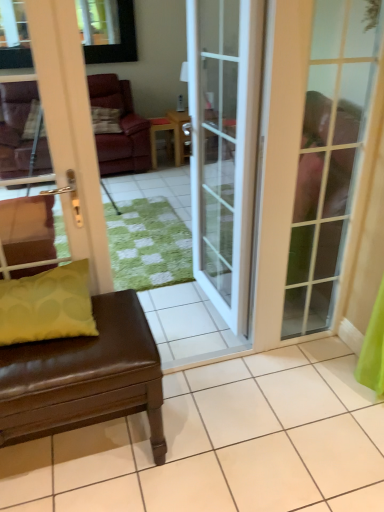
The image size is (384, 512). In order to click on matte glass door at right, positioned as the first door in right-to-left order in this screenshot , I will do `click(314, 161)`.

Measure the distance between point (56, 322) and camera.

Point (56, 322) and camera are 4.60 feet apart.

Locate an element on the screen. Image resolution: width=384 pixels, height=512 pixels. white glossy door at left, the third door viewed from the right is located at coordinates (70, 131).

Identify the location of wooden side table at center. This screenshot has height=512, width=384. (167, 131).

Where is `brown leather studio couch at left`? brown leather studio couch at left is located at coordinates (84, 376).

From a real-world perspective, which object stands above the other?

white glass door at center, the second door viewed from the left, is physically above.

Consider the image. Which object is closer to the camera taking this photo, matte glass door at right, which appears as the third door when viewed from the left, or white glass door at center, the 2th door when ordered from right to left?

matte glass door at right, which appears as the third door when viewed from the left, is closer to the camera.

Is matte glass door at right, which appears as the third door when viewed from the left, not inside white glass door at center, the 2th door when ordered from right to left?

Yes, matte glass door at right, which appears as the third door when viewed from the left, is located beyond the bounds of white glass door at center, the 2th door when ordered from right to left.

Who is shorter, matte glass door at right, positioned as the first door in right-to-left order, or white glass door at center, the 2th door when ordered from right to left?

matte glass door at right, positioned as the first door in right-to-left order.

Which is closer to the camera, (x=238, y=106) or (x=67, y=401)?

The point (x=67, y=401) is closer.

Between white glass door at center, the second door viewed from the left, and brown leather studio couch at left, which one has smaller width?

white glass door at center, the second door viewed from the left.

From their relative heights in the image, would you say white glass door at center, the second door viewed from the left, is taller or shorter than brown leather studio couch at left?

Considering their sizes, white glass door at center, the second door viewed from the left, has more height than brown leather studio couch at left.

Based on the photo, from the image's perspective, is white glass door at center, the second door viewed from the left, above or below brown leather studio couch at left?

From the image's perspective, white glass door at center, the second door viewed from the left, appears above brown leather studio couch at left.

Considering the sizes of objects white glass door at center, the 2th door when ordered from right to left, and wooden side table at center in the image provided, who is bigger, white glass door at center, the 2th door when ordered from right to left, or wooden side table at center?

With larger size is wooden side table at center.

Is white glass door at center, the 2th door when ordered from right to left, wider than wooden side table at center?

In fact, white glass door at center, the 2th door when ordered from right to left, might be narrower than wooden side table at center.

Find the location of a particular element. The image size is (384, 512). the 1st door to the right when counting from the wooden side table at center is located at coordinates (224, 146).

Is white glass door at center, the 2th door when ordered from right to left, to the right of wooden side table at center from the viewer's perspective?

Indeed, white glass door at center, the 2th door when ordered from right to left, is positioned on the right side of wooden side table at center.

Is matte glass door at right, positioned as the first door in right-to-left order, in front of wooden side table at center?

Yes, it is.

How different are the orientations of matte glass door at right, positioned as the first door in right-to-left order, and wooden side table at center in degrees?

The angular difference between matte glass door at right, positioned as the first door in right-to-left order, and wooden side table at center is 3.07 degrees.

Identify the location of the 2nd door in front when counting from the wooden side table at center. (314, 161).

Between point (237, 38) and point (174, 143), which one is positioned in front?

The point (237, 38) is in front.

Is brown leather studio couch at left at the left side of white glass door at center, the second door viewed from the left?

Correct, you'll find brown leather studio couch at left to the left of white glass door at center, the second door viewed from the left.

Locate an element on the screen. Image resolution: width=384 pixels, height=512 pixels. studio couch that appears below the white glass door at center, the second door viewed from the left (from the image's perspective) is located at coordinates (84, 376).

Which object is closer to the camera taking this photo, brown leather studio couch at left or white glass door at center, the 2th door when ordered from right to left?

brown leather studio couch at left is closer to the camera.

From a real-world perspective, between brown leather studio couch at left and white glass door at center, the second door viewed from the left, who is vertically higher?

In real-world perspective, white glass door at center, the second door viewed from the left, is above.

Based on the photo, is brown leather studio couch at left to the left of wooden side table at center from the viewer's perspective?

Yes.

From a real-world perspective, which object stands above the other?

brown leather studio couch at left.

From the image's perspective, is brown leather studio couch at left located beneath wooden side table at center?

Yes, from the image's perspective, brown leather studio couch at left is beneath wooden side table at center.

Is wooden side table at center to the left or to the right of white glass door at center, the 2th door when ordered from right to left, in the image?

wooden side table at center is positioned on white glass door at center, the 2th door when ordered from right to left,'s left side.

From a real-world perspective, between wooden side table at center and white glass door at center, the 2th door when ordered from right to left, who is vertically higher?

white glass door at center, the 2th door when ordered from right to left.

Considering the positions of objects wooden side table at center and white glass door at center, the second door viewed from the left, in the image provided, who is in front, wooden side table at center or white glass door at center, the second door viewed from the left,?

white glass door at center, the second door viewed from the left, is more forward.

Can you confirm if wooden side table at center is thinner than white glass door at center, the 2th door when ordered from right to left?

No, wooden side table at center is not thinner than white glass door at center, the 2th door when ordered from right to left.

Where is `door that is the 2nd object located above the matte glass door at right, positioned as the first door in right-to-left order (from the image's perspective)`? Image resolution: width=384 pixels, height=512 pixels. door that is the 2nd object located above the matte glass door at right, positioned as the first door in right-to-left order (from the image's perspective) is located at coordinates (224, 146).

Where is `studio couch directly beneath the white glass door at center, the second door viewed from the left (from a real-world perspective)`? The width and height of the screenshot is (384, 512). studio couch directly beneath the white glass door at center, the second door viewed from the left (from a real-world perspective) is located at coordinates (84, 376).

From the image, which object appears to be farther from matte glass door at right, positioned as the first door in right-to-left order, brown leather studio couch at left or white glossy door at left, which is the 1th door from left to right?

white glossy door at left, which is the 1th door from left to right, is further to matte glass door at right, positioned as the first door in right-to-left order.

Looking at the image, which one is located further to matte yellow pillow at lower left, wooden side table at center or white glossy door at left, the third door viewed from the right?

wooden side table at center.

Based on the photo, based on their spatial positions, is white glass door at center, the second door viewed from the left, or matte yellow pillow at lower left further from brown leather studio couch at left?

white glass door at center, the second door viewed from the left, is further to brown leather studio couch at left.

Considering their positions, is brown leather studio couch at left positioned closer to matte yellow pillow at lower left than wooden side table at center?

brown leather studio couch at left lies closer to matte yellow pillow at lower left than the other object.

Considering their positions, is white glossy door at left, the third door viewed from the right, positioned further to matte glass door at right, positioned as the first door in right-to-left order, than wooden side table at center?

Among the two, wooden side table at center is located further to matte glass door at right, positioned as the first door in right-to-left order.

When comparing their distances from matte glass door at right, positioned as the first door in right-to-left order, does matte yellow pillow at lower left or white glossy door at left, which is the 1th door from left to right, seem further?

matte yellow pillow at lower left lies further to matte glass door at right, positioned as the first door in right-to-left order, than the other object.

Which object lies nearer to the anchor point brown leather studio couch at left, matte glass door at right, which appears as the third door when viewed from the left, or white glossy door at left, which is the 1th door from left to right?

Based on the image, white glossy door at left, which is the 1th door from left to right, appears to be nearer to brown leather studio couch at left.

Which object lies nearer to the anchor point matte yellow pillow at lower left, wooden side table at center or brown leather studio couch at left?

Among the two, brown leather studio couch at left is located nearer to matte yellow pillow at lower left.

You are a GUI agent. You are given a task and a screenshot of the screen. Output one action in this format:
    pyautogui.click(x=<x>, y=<y>)
    Task: Click on the pillow between white glass door at center, the second door viewed from the left, and brown leather studio couch at left vertically
    The image size is (384, 512).
    Given the screenshot: What is the action you would take?
    pyautogui.click(x=47, y=305)

Image resolution: width=384 pixels, height=512 pixels. What are the coordinates of `pillow situated between white glossy door at left, which is the 1th door from left to right, and matte glass door at right, positioned as the first door in right-to-left order, from left to right` in the screenshot? It's located at (47, 305).

Find the location of `pillow between brown leather studio couch at left and wooden side table at center from front to back`. pillow between brown leather studio couch at left and wooden side table at center from front to back is located at coordinates coord(47,305).

The image size is (384, 512). I want to click on studio couch between white glossy door at left, which is the 1th door from left to right, and wooden side table at center in the front-back direction, so click(84, 376).